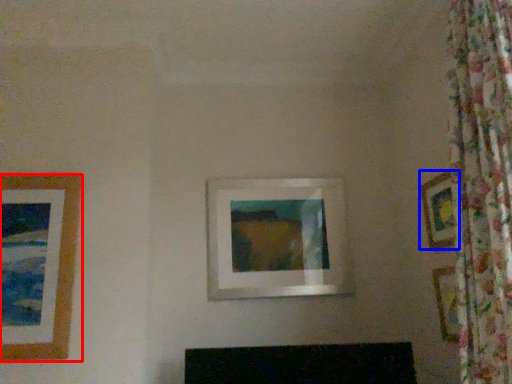
Question: Which point is closer to the camera, picture frame (highlighted by a red box) or picture frame (highlighted by a blue box)?

Choices:
 (A) picture frame
 (B) picture frame

Answer: (A)